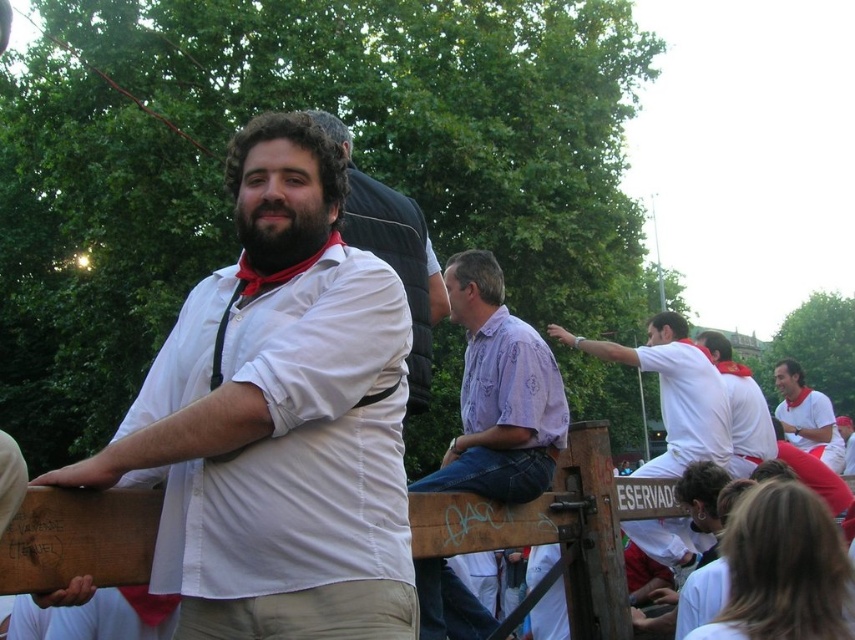
Question: Is khaki pants at center to the left of purple patterned shirt at center from the viewer's perspective?

Choices:
 (A) yes
 (B) no

Answer: (A)

Question: From the image, what is the correct spatial relationship of khaki pants at center in relation to white matte shirt at center?

Choices:
 (A) left
 (B) right

Answer: (A)

Question: Among these objects, which one is nearest to the camera?

Choices:
 (A) khaki pants at center
 (B) white cotton shirt at center
 (C) purple patterned shirt at center
 (D) white matte shirt at center

Answer: (A)

Question: Which point is farther to the camera?

Choices:
 (A) white cotton shirt at upper right
 (B) white matte shirt at center

Answer: (A)

Question: Can you confirm if purple patterned shirt at center is wider than white cotton shirt at center?

Choices:
 (A) yes
 (B) no

Answer: (B)

Question: Which of these objects is positioned closest to the white matte shirt at center?

Choices:
 (A) khaki pants at center
 (B) white cotton shirt at upper right

Answer: (A)